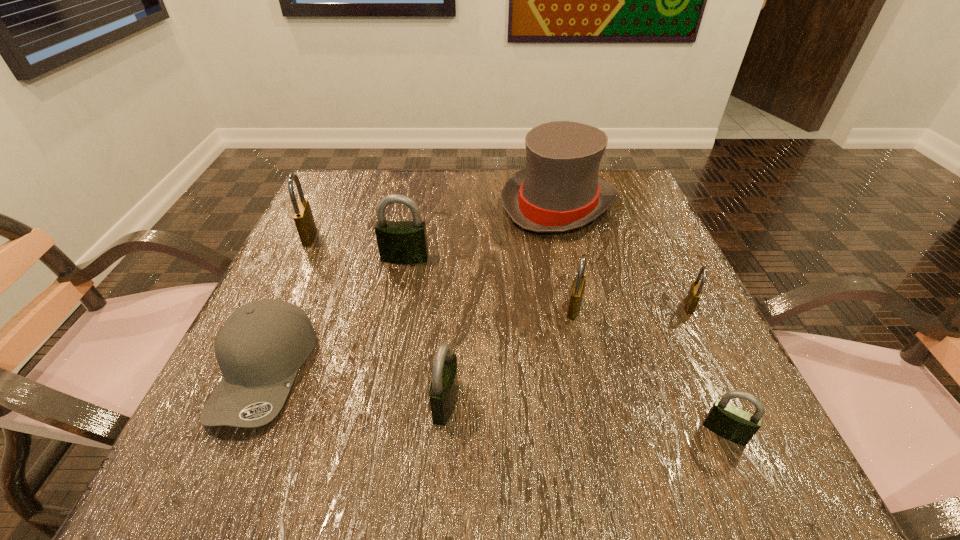
Where is `gray dress hat`? gray dress hat is located at coordinates (559, 190).

Find the location of `the leftmost brass padlock`. the leftmost brass padlock is located at coordinates (303, 217).

You are a GUI agent. You are given a task and a screenshot of the screen. Output one action in this format:
    pyautogui.click(x=<x>, y=<y>)
    Task: Click on the farthest padlock
    The width and height of the screenshot is (960, 540).
    Given the screenshot: What is the action you would take?
    pyautogui.click(x=303, y=217)

The image size is (960, 540). Identify the location of the third object from left to right. (399, 242).

Find the location of a particular element. the biggest black padlock is located at coordinates (399, 242).

Where is `the second smallest brass padlock`? the second smallest brass padlock is located at coordinates (578, 286).

This screenshot has width=960, height=540. In order to click on the second brass padlock from right to left in this screenshot , I will do `click(578, 286)`.

The width and height of the screenshot is (960, 540). I want to click on the second black padlock from right to left, so click(x=443, y=392).

This screenshot has width=960, height=540. I want to click on the second smallest black padlock, so click(443, 392).

Identify the location of baseball cap. (261, 346).